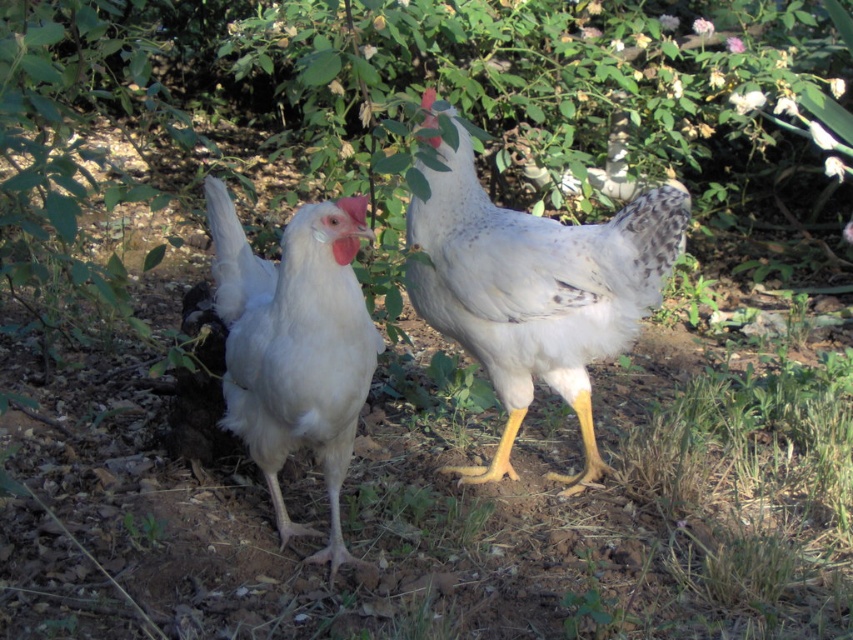
In order to click on white speckled feather at center in this screenshot , I will do `click(537, 291)`.

Can you confirm if white speckled feather at center is smaller than white feathered chicken at center?

No, white speckled feather at center is not smaller than white feathered chicken at center.

Find the location of a particular element. white speckled feather at center is located at coordinates (537, 291).

You are a GUI agent. You are given a task and a screenshot of the screen. Output one action in this format:
    pyautogui.click(x=<x>, y=<y>)
    Task: Click on the white speckled feather at center
    
    Given the screenshot: What is the action you would take?
    pyautogui.click(x=537, y=291)